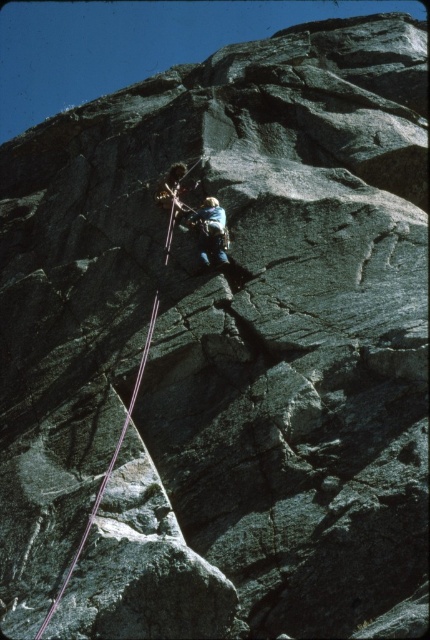
Question: Which of the following is the closest to the observer?

Choices:
 (A) camouflage fabric climbing harness at center
 (B) purple synthetic rope at center

Answer: (B)

Question: Can you confirm if purple synthetic rope at center is thinner than camouflage fabric climbing harness at center?

Choices:
 (A) no
 (B) yes

Answer: (A)

Question: Considering the relative positions of purple synthetic rope at center and camouflage fabric climbing harness at center in the image provided, where is purple synthetic rope at center located with respect to camouflage fabric climbing harness at center?

Choices:
 (A) above
 (B) below

Answer: (B)

Question: Which point is farther to the camera?

Choices:
 (A) purple synthetic rope at center
 (B) camouflage fabric climbing harness at center

Answer: (B)

Question: Does purple synthetic rope at center appear on the right side of camouflage fabric climbing harness at center?

Choices:
 (A) no
 (B) yes

Answer: (A)